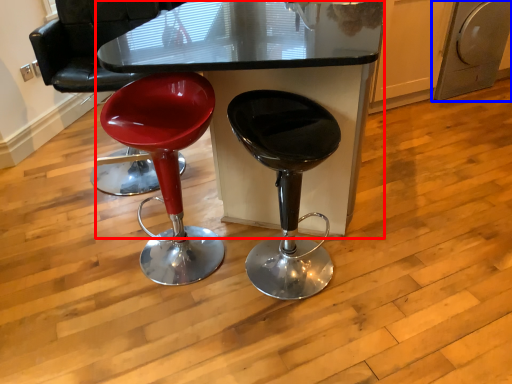
Question: Which of the following is the farthest to the observer, table (highlighted by a red box) or dish washer (highlighted by a blue box)?

Choices:
 (A) table
 (B) dish washer

Answer: (B)